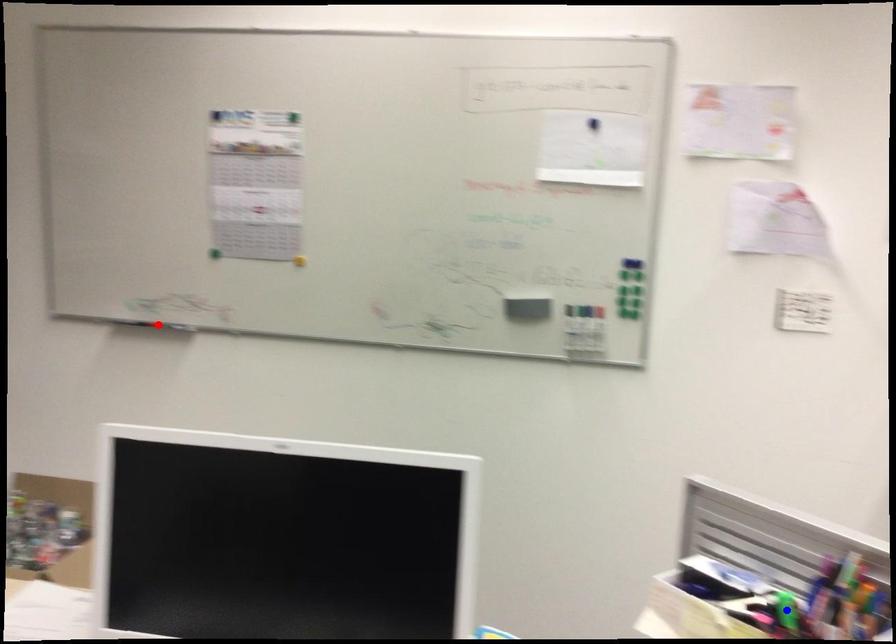
Question: Two points are marked on the image. Which point is closer to the camera?

Choices:
 (A) Blue point is closer.
 (B) Red point is closer.

Answer: (A)